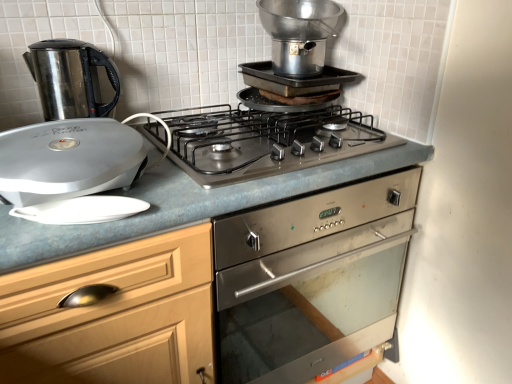
How much space does stainless steel kettle at left, acting as the third kitchen appliance starting from the right, occupy vertically?

The height of stainless steel kettle at left, acting as the third kitchen appliance starting from the right, is 9.27 inches.

Where is `metallic silver pot at upper center, marked as the third kitchen appliance in a left-to-right arrangement`? The height and width of the screenshot is (384, 512). metallic silver pot at upper center, marked as the third kitchen appliance in a left-to-right arrangement is located at coordinates (298, 34).

Locate an element on the screen. Image resolution: width=512 pixels, height=384 pixels. silver metallic george foreman grill at left, the 2th kitchen appliance positioned from the right is located at coordinates (68, 159).

Is metallic silver pot at upper center, marked as the third kitchen appliance in a left-to-right arrangement, to the left of silver metallic george foreman grill at left, the 2th kitchen appliance positioned from the right, from the viewer's perspective?

Incorrect, metallic silver pot at upper center, marked as the third kitchen appliance in a left-to-right arrangement, is not on the left side of silver metallic george foreman grill at left, the 2th kitchen appliance positioned from the right.

Is metallic silver pot at upper center, which appears as the 1th kitchen appliance when viewed from the right, beside silver metallic george foreman grill at left, the 2th kitchen appliance positioned from the right?

No, metallic silver pot at upper center, which appears as the 1th kitchen appliance when viewed from the right, is not next to silver metallic george foreman grill at left, the 2th kitchen appliance positioned from the right.

Does metallic silver pot at upper center, which appears as the 1th kitchen appliance when viewed from the right, come in front of silver metallic george foreman grill at left, the 2th kitchen appliance positioned from the right?

No, it is behind silver metallic george foreman grill at left, the 2th kitchen appliance positioned from the right.

Is metallic silver pot at upper center, which appears as the 1th kitchen appliance when viewed from the right, beside stainless steel kettle at left, which is counted as the 1th kitchen appliance, starting from the left?

They are not placed beside each other.

From the image's perspective, is metallic silver pot at upper center, which appears as the 1th kitchen appliance when viewed from the right, above or below stainless steel kettle at left, which is counted as the 1th kitchen appliance, starting from the left?

Clearly, from the image's perspective, metallic silver pot at upper center, which appears as the 1th kitchen appliance when viewed from the right, is above stainless steel kettle at left, which is counted as the 1th kitchen appliance, starting from the left.

Between metallic silver pot at upper center, marked as the third kitchen appliance in a left-to-right arrangement, and stainless steel kettle at left, acting as the third kitchen appliance starting from the right, which one has larger size?

Bigger between the two is metallic silver pot at upper center, marked as the third kitchen appliance in a left-to-right arrangement.

Between metallic silver pot at upper center, which appears as the 1th kitchen appliance when viewed from the right, and stainless steel kettle at left, which is counted as the 1th kitchen appliance, starting from the left, which one has smaller width?

stainless steel kettle at left, which is counted as the 1th kitchen appliance, starting from the left, is thinner.

Based on the photo, considering the sizes of blue laminate countertop at center and silver metallic george foreman grill at left, acting as the 2th kitchen appliance starting from the left, in the image, is blue laminate countertop at center bigger or smaller than silver metallic george foreman grill at left, acting as the 2th kitchen appliance starting from the left,?

blue laminate countertop at center is bigger than silver metallic george foreman grill at left, acting as the 2th kitchen appliance starting from the left.

Is blue laminate countertop at center not within silver metallic george foreman grill at left, acting as the 2th kitchen appliance starting from the left?

That's correct, blue laminate countertop at center is outside of silver metallic george foreman grill at left, acting as the 2th kitchen appliance starting from the left.

Is blue laminate countertop at center to the left of silver metallic george foreman grill at left, acting as the 2th kitchen appliance starting from the left, from the viewer's perspective?

No.

Is satin silver gas stove at center spatially inside metallic silver pot at upper center, marked as the third kitchen appliance in a left-to-right arrangement, or outside of it?

satin silver gas stove at center is not enclosed by metallic silver pot at upper center, marked as the third kitchen appliance in a left-to-right arrangement.

Is satin silver gas stove at center facing away from metallic silver pot at upper center, marked as the third kitchen appliance in a left-to-right arrangement?

No, satin silver gas stove at center is not facing the opposite direction of metallic silver pot at upper center, marked as the third kitchen appliance in a left-to-right arrangement.

From their relative heights in the image, would you say satin silver gas stove at center is taller or shorter than metallic silver pot at upper center, which appears as the 1th kitchen appliance when viewed from the right?

satin silver gas stove at center is shorter than metallic silver pot at upper center, which appears as the 1th kitchen appliance when viewed from the right.

Consider the image. Considering the positions of objects satin silver gas stove at center and metallic silver pot at upper center, marked as the third kitchen appliance in a left-to-right arrangement, in the image provided, who is in front, satin silver gas stove at center or metallic silver pot at upper center, marked as the third kitchen appliance in a left-to-right arrangement,?

satin silver gas stove at center is in front.

Considering the relative sizes of stainless steel kettle at left, acting as the third kitchen appliance starting from the right, and blue laminate countertop at center in the image provided, is stainless steel kettle at left, acting as the third kitchen appliance starting from the right, wider than blue laminate countertop at center?

No, stainless steel kettle at left, acting as the third kitchen appliance starting from the right, is not wider than blue laminate countertop at center.

Is stainless steel kettle at left, which is counted as the 1th kitchen appliance, starting from the left, positioned with its back to blue laminate countertop at center?

stainless steel kettle at left, which is counted as the 1th kitchen appliance, starting from the left, does not have its back to blue laminate countertop at center.

How far apart are stainless steel kettle at left, acting as the third kitchen appliance starting from the right, and blue laminate countertop at center?

stainless steel kettle at left, acting as the third kitchen appliance starting from the right, is 56.14 centimeters away from blue laminate countertop at center.

Looking at the image, does stainless steel kettle at left, acting as the third kitchen appliance starting from the right, seem bigger or smaller compared to blue laminate countertop at center?

In the image, stainless steel kettle at left, acting as the third kitchen appliance starting from the right, appears to be smaller than blue laminate countertop at center.

Where is `kitchen appliance located on the right of blue laminate countertop at center`? This screenshot has height=384, width=512. kitchen appliance located on the right of blue laminate countertop at center is located at coordinates (298, 34).

Between metallic silver pot at upper center, which appears as the 1th kitchen appliance when viewed from the right, and blue laminate countertop at center, which one is positioned behind?

metallic silver pot at upper center, which appears as the 1th kitchen appliance when viewed from the right, is further from the camera.

Based on the photo, could you measure the distance between metallic silver pot at upper center, which appears as the 1th kitchen appliance when viewed from the right, and blue laminate countertop at center?

metallic silver pot at upper center, which appears as the 1th kitchen appliance when viewed from the right, is 20.27 inches from blue laminate countertop at center.

Is satin silver gas stove at center aimed at silver metallic george foreman grill at left, acting as the 2th kitchen appliance starting from the left?

No, satin silver gas stove at center is not turned towards silver metallic george foreman grill at left, acting as the 2th kitchen appliance starting from the left.

Considering the relative positions of satin silver gas stove at center and silver metallic george foreman grill at left, the 2th kitchen appliance positioned from the right, in the image provided, is satin silver gas stove at center to the left or to the right of silver metallic george foreman grill at left, the 2th kitchen appliance positioned from the right,?

satin silver gas stove at center is to the right of silver metallic george foreman grill at left, the 2th kitchen appliance positioned from the right.

Which object is further away from the camera taking this photo, satin silver gas stove at center or silver metallic george foreman grill at left, acting as the 2th kitchen appliance starting from the left?

satin silver gas stove at center is further away from the camera.

Which of these two, satin silver gas stove at center or silver metallic george foreman grill at left, acting as the 2th kitchen appliance starting from the left, is smaller?

silver metallic george foreman grill at left, acting as the 2th kitchen appliance starting from the left, is smaller.

Starting from the metallic silver pot at upper center, marked as the third kitchen appliance in a left-to-right arrangement, which kitchen appliance is the 2nd one in front? Please provide its 2D coordinates.

[(68, 159)]

In order to click on the 2nd kitchen appliance to the right when counting from the stainless steel kettle at left, which is counted as the 1th kitchen appliance, starting from the left in this screenshot , I will do `click(298, 34)`.

Looking at the image, which one is located closer to silver metallic george foreman grill at left, the 2th kitchen appliance positioned from the right, blue laminate countertop at center or satin silver gas stove at center?

The object closer to silver metallic george foreman grill at left, the 2th kitchen appliance positioned from the right, is satin silver gas stove at center.

Looking at the image, which one is located further to silver metallic george foreman grill at left, acting as the 2th kitchen appliance starting from the left, satin silver gas stove at center or blue laminate countertop at center?

blue laminate countertop at center.

Based on their spatial positions, is satin silver gas stove at center or stainless steel kettle at left, which is counted as the 1th kitchen appliance, starting from the left, further from silver metallic george foreman grill at left, the 2th kitchen appliance positioned from the right?

satin silver gas stove at center.

From the image, which object appears to be nearer to silver metallic george foreman grill at left, the 2th kitchen appliance positioned from the right, metallic silver pot at upper center, marked as the third kitchen appliance in a left-to-right arrangement, or satin silver gas stove at center?

satin silver gas stove at center is closer to silver metallic george foreman grill at left, the 2th kitchen appliance positioned from the right.

Considering their positions, is blue laminate countertop at center positioned further to metallic silver pot at upper center, marked as the third kitchen appliance in a left-to-right arrangement, than silver metallic george foreman grill at left, the 2th kitchen appliance positioned from the right?

The object further to metallic silver pot at upper center, marked as the third kitchen appliance in a left-to-right arrangement, is silver metallic george foreman grill at left, the 2th kitchen appliance positioned from the right.

From the image, which object appears to be farther from metallic silver pot at upper center, marked as the third kitchen appliance in a left-to-right arrangement, stainless steel kettle at left, acting as the third kitchen appliance starting from the right, or blue laminate countertop at center?

stainless steel kettle at left, acting as the third kitchen appliance starting from the right.

From the image, which object appears to be farther from stainless steel kettle at left, acting as the third kitchen appliance starting from the right, satin silver gas stove at center or blue laminate countertop at center?

blue laminate countertop at center is further to stainless steel kettle at left, acting as the third kitchen appliance starting from the right.

Estimate the real-world distances between objects in this image. Which object is closer to silver metallic george foreman grill at left, the 2th kitchen appliance positioned from the right, stainless steel kettle at left, which is counted as the 1th kitchen appliance, starting from the left, or blue laminate countertop at center?

stainless steel kettle at left, which is counted as the 1th kitchen appliance, starting from the left.

Identify the location of gas stove between silver metallic george foreman grill at left, acting as the 2th kitchen appliance starting from the left, and metallic silver pot at upper center, marked as the third kitchen appliance in a left-to-right arrangement. (265, 141).

What are the coordinates of `gas stove that lies between metallic silver pot at upper center, marked as the third kitchen appliance in a left-to-right arrangement, and blue laminate countertop at center from top to bottom` in the screenshot? It's located at (265, 141).

Image resolution: width=512 pixels, height=384 pixels. I want to click on kitchen appliance located between stainless steel kettle at left, which is counted as the 1th kitchen appliance, starting from the left, and satin silver gas stove at center in the left-right direction, so click(x=68, y=159).

The width and height of the screenshot is (512, 384). I want to click on gas stove between stainless steel kettle at left, which is counted as the 1th kitchen appliance, starting from the left, and blue laminate countertop at center in the up-down direction, so click(x=265, y=141).